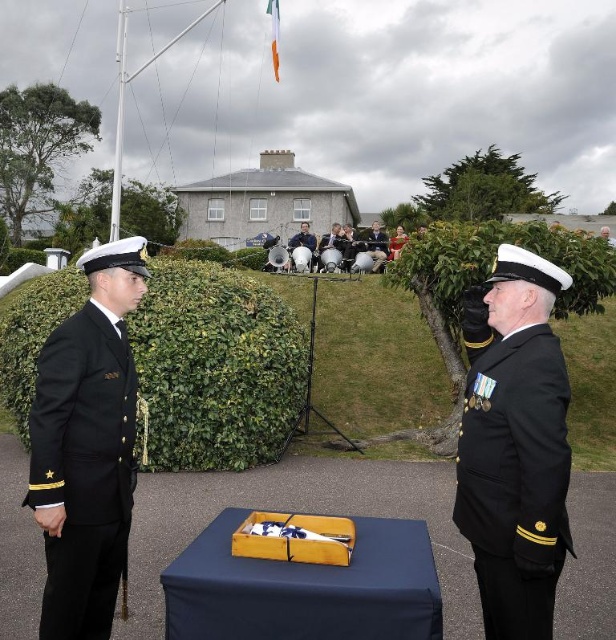
Question: Which object is positioned closest to the dark blue uniform at center?

Choices:
 (A) black matte uniform at left
 (B) navy blue fabric-covered table at center
 (C) green leafy hedge at center

Answer: (C)

Question: Is black matte uniform at left thinner than smooth white uniform at center?

Choices:
 (A) no
 (B) yes

Answer: (B)

Question: In this image, where is black matte uniform at right located relative to black matte uniform at left?

Choices:
 (A) above
 (B) below

Answer: (A)

Question: Is black matte uniform at left further to camera compared to navy blue fabric-covered table at center?

Choices:
 (A) yes
 (B) no

Answer: (A)

Question: Among these objects, which one is farthest from the camera?

Choices:
 (A) smooth white uniform at center
 (B) navy blue fabric-covered table at center
 (C) green leafy hedge at center

Answer: (A)

Question: Which is nearer to the black matte uniform at right?

Choices:
 (A) dark blue uniform at center
 (B) navy blue fabric-covered table at center
 (C) black matte uniform at left
 (D) green leafy hedge at center

Answer: (B)